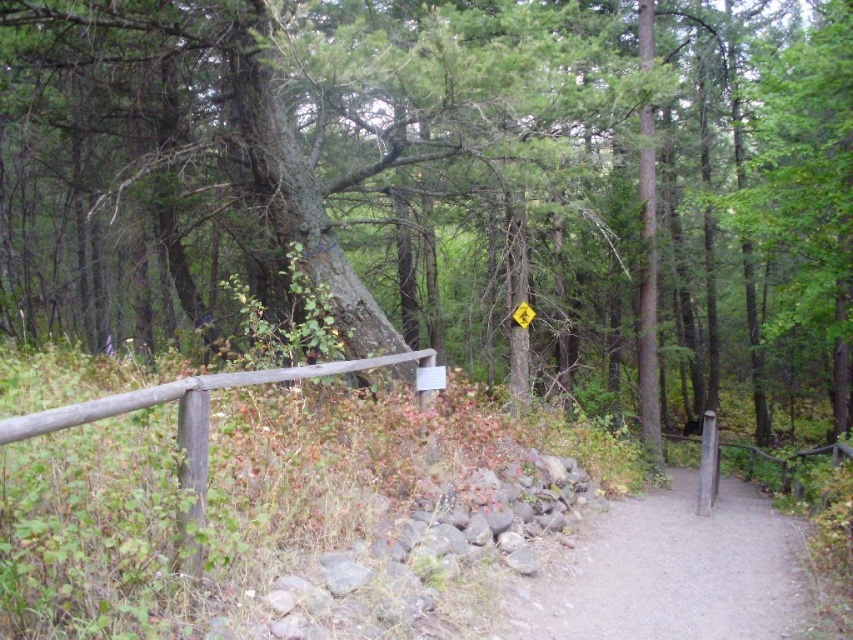
You are a hiker carrying a 10 meter long rope. You want to tie the green rough bark tree at center to the wooden fence at center to secure your gear. Is the rope long enough to reach between them?

The green rough bark tree at center is 13.80 meters from wooden fence at center. The rope is only 10 meters long, so it is not long enough to reach between them.